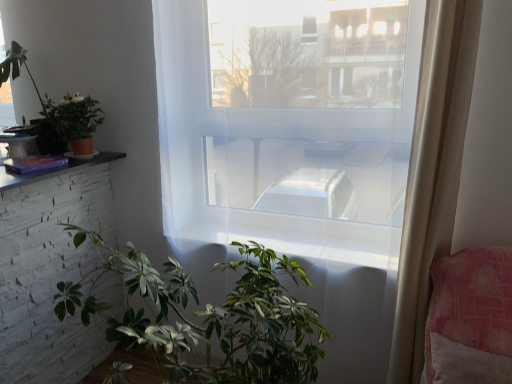
Where is `transparent glass window at center`? transparent glass window at center is located at coordinates (288, 122).

What is the approximate width of matte white table at left?

The width of matte white table at left is 31.16 inches.

Describe the element at coordinates (221, 317) in the screenshot. I see `green matte plant at lower center, acting as the first houseplant starting from the bottom` at that location.

Where is `green matte plant at upper left, which is the first houseplant from left to right`? This screenshot has height=384, width=512. green matte plant at upper left, which is the first houseplant from left to right is located at coordinates (59, 110).

Locate an element on the screen. green matte plant at upper left, placed as the second houseplant when sorted from bottom to top is located at coordinates (69, 124).

The image size is (512, 384). I want to click on transparent glass window at center, so click(288, 122).

Is point (65, 329) behind point (60, 116)?

Yes, it is behind point (60, 116).

From the picture: Can you confirm if matte white table at left is positioned to the left of green matte plant at upper left, which ranks as the 3th houseplant in bottom-to-top order?

Correct, you'll find matte white table at left to the left of green matte plant at upper left, which ranks as the 3th houseplant in bottom-to-top order.

Is matte white table at left directly adjacent to green matte plant at upper left, which is the first houseplant from left to right?

No, matte white table at left is not with green matte plant at upper left, which is the first houseplant from left to right.

Can you tell me how much matte white table at left and green matte plant at upper left, which ranks as the 3th houseplant in bottom-to-top order, differ in facing direction?

They differ by 90 degrees in their facing directions.

Considering the relative sizes of transparent glass window at center and matte white table at left in the image provided, is transparent glass window at center smaller than matte white table at left?

Indeed, transparent glass window at center has a smaller size compared to matte white table at left.

Between transparent glass window at center and matte white table at left, which one appears on the left side from the viewer's perspective?

Positioned to the left is matte white table at left.

Is transparent glass window at center not near matte white table at left?

transparent glass window at center is near matte white table at left, not far away.

Do you think transparent glass window at center is within matte white table at left, or outside of it?

transparent glass window at center is outside matte white table at left.

Can you confirm if transparent glass window at center is positioned to the left of green matte plant at upper left, placed as the 2th houseplant when sorted from right to left?

In fact, transparent glass window at center is to the right of green matte plant at upper left, placed as the 2th houseplant when sorted from right to left.

Considering their positions, is transparent glass window at center located in front of or behind green matte plant at upper left, placed as the 2th houseplant when sorted from right to left?

Visually, transparent glass window at center is located in front of green matte plant at upper left, placed as the 2th houseplant when sorted from right to left.

Considering the relative sizes of transparent glass window at center and green matte plant at upper left, positioned as the second houseplant in top-to-bottom order, in the image provided, is transparent glass window at center smaller than green matte plant at upper left, positioned as the second houseplant in top-to-bottom order,?

Incorrect, transparent glass window at center is not smaller in size than green matte plant at upper left, positioned as the second houseplant in top-to-bottom order.

Would you say transparent glass window at center is outside green matte plant at upper left, placed as the 2th houseplant when sorted from right to left?

Absolutely, transparent glass window at center is external to green matte plant at upper left, placed as the 2th houseplant when sorted from right to left.

Would you say matte white table at left is outside green matte plant at upper left, which is the second houseplant from left to right?

Indeed, matte white table at left is completely outside green matte plant at upper left, which is the second houseplant from left to right.

Between matte white table at left and green matte plant at upper left, placed as the second houseplant when sorted from bottom to top, which one is positioned in front?

matte white table at left is closer to the camera.

The height and width of the screenshot is (384, 512). In the image, there is a green matte plant at upper left, positioned as the second houseplant in top-to-bottom order. Find the location of `table below it (from a real-world perspective)`. table below it (from a real-world perspective) is located at coordinates (50, 269).

From the image's perspective, is matte white table at left positioned above or below green matte plant at upper left, placed as the second houseplant when sorted from bottom to top?

From the image's perspective, matte white table at left appears below green matte plant at upper left, placed as the second houseplant when sorted from bottom to top.

Does matte white table at left touch green matte plant at lower center, acting as the third houseplant starting from the top?

No, matte white table at left is not touching green matte plant at lower center, acting as the third houseplant starting from the top.

Between matte white table at left and green matte plant at lower center, which ranks as the first houseplant in right-to-left order, which one appears on the right side from the viewer's perspective?

From the viewer's perspective, green matte plant at lower center, which ranks as the first houseplant in right-to-left order, appears more on the right side.

Is matte white table at left positioned beyond the bounds of green matte plant at lower center, acting as the third houseplant starting from the top?

matte white table at left lies outside green matte plant at lower center, acting as the third houseplant starting from the top,'s area.

From a real-world perspective, is matte white table at left positioned above or below green matte plant at lower center, which ranks as the first houseplant in right-to-left order?

From a real-world perspective, matte white table at left is physically above green matte plant at lower center, which ranks as the first houseplant in right-to-left order.

Would you say green matte plant at lower center, acting as the first houseplant starting from the bottom, is outside green matte plant at upper left, placed as the second houseplant when sorted from bottom to top?

Indeed, green matte plant at lower center, acting as the first houseplant starting from the bottom, is completely outside green matte plant at upper left, placed as the second houseplant when sorted from bottom to top.

Which is closer to the camera, (215, 381) or (49, 124)?

The point (215, 381) is closer.

Looking at this image, from a real-world perspective, is green matte plant at lower center, acting as the third houseplant starting from the top, on top of green matte plant at upper left, placed as the second houseplant when sorted from bottom to top?

Incorrect, from a real-world perspective, green matte plant at lower center, acting as the third houseplant starting from the top, is lower than green matte plant at upper left, placed as the second houseplant when sorted from bottom to top.

Is green matte plant at lower center, acting as the first houseplant starting from the bottom, at the left side of green matte plant at upper left, placed as the second houseplant when sorted from bottom to top?

No.

Is green matte plant at upper left, placed as the second houseplant when sorted from bottom to top, facing away from green matte plant at upper left, which ranks as the 3th houseplant in bottom-to-top order?

No.

From the image's perspective, would you say green matte plant at upper left, which is the second houseplant from left to right, is shown under green matte plant at upper left, which is the 1th houseplant in top-to-bottom order?

Correct, green matte plant at upper left, which is the second houseplant from left to right, appears lower than green matte plant at upper left, which is the 1th houseplant in top-to-bottom order, in the image.

Looking at this image, can you confirm if green matte plant at upper left, placed as the 2th houseplant when sorted from right to left, is wider than green matte plant at upper left, the 3th houseplant in the right-to-left sequence?

In fact, green matte plant at upper left, placed as the 2th houseplant when sorted from right to left, might be narrower than green matte plant at upper left, the 3th houseplant in the right-to-left sequence.

Is green matte plant at upper left, placed as the 2th houseplant when sorted from right to left, shorter than green matte plant at upper left, which ranks as the 3th houseplant in bottom-to-top order?

Yes.

Find the location of a particular element. the 1st houseplant counting from the right side of the matte white table at left is located at coordinates (59, 110).

Locate an element on the screen. Image resolution: width=512 pixels, height=384 pixels. table on the left of transparent glass window at center is located at coordinates (50, 269).

Considering their positions, is green matte plant at upper left, the 3th houseplant in the right-to-left sequence, positioned further to green matte plant at lower center, acting as the third houseplant starting from the top, than matte white table at left?

green matte plant at upper left, the 3th houseplant in the right-to-left sequence, is further to green matte plant at lower center, acting as the third houseplant starting from the top.

Estimate the real-world distances between objects in this image. Which object is further from green matte plant at upper left, which is the first houseplant from left to right, green matte plant at upper left, which is the second houseplant from left to right, or green matte plant at lower center, acting as the first houseplant starting from the bottom?

The object further to green matte plant at upper left, which is the first houseplant from left to right, is green matte plant at lower center, acting as the first houseplant starting from the bottom.

Which object lies further to the anchor point green matte plant at upper left, which is the second houseplant from left to right, green matte plant at upper left, which is the 1th houseplant in top-to-bottom order, or green matte plant at lower center, acting as the first houseplant starting from the bottom?

green matte plant at lower center, acting as the first houseplant starting from the bottom.

Based on their spatial positions, is green matte plant at upper left, positioned as the second houseplant in top-to-bottom order, or green matte plant at lower center, which ranks as the first houseplant in right-to-left order, further from transparent glass window at center?

green matte plant at upper left, positioned as the second houseplant in top-to-bottom order, lies further to transparent glass window at center than the other object.

Estimate the real-world distances between objects in this image. Which object is further from green matte plant at upper left, which is the second houseplant from left to right, green matte plant at upper left, which is the 1th houseplant in top-to-bottom order, or transparent glass window at center?

Among the two, transparent glass window at center is located further to green matte plant at upper left, which is the second houseplant from left to right.

When comparing their distances from matte white table at left, does green matte plant at upper left, placed as the second houseplant when sorted from bottom to top, or green matte plant at lower center, acting as the first houseplant starting from the bottom, seem further?

Among the two, green matte plant at lower center, acting as the first houseplant starting from the bottom, is located further to matte white table at left.

When comparing their distances from green matte plant at upper left, which is the second houseplant from left to right, does transparent glass window at center or green matte plant at upper left, which ranks as the 3th houseplant in bottom-to-top order, seem further?

transparent glass window at center is positioned further to the anchor green matte plant at upper left, which is the second houseplant from left to right.

When comparing their distances from green matte plant at upper left, which is the second houseplant from left to right, does green matte plant at lower center, acting as the third houseplant starting from the top, or transparent glass window at center seem further?

The object further to green matte plant at upper left, which is the second houseplant from left to right, is green matte plant at lower center, acting as the third houseplant starting from the top.

Locate an element on the screen. The width and height of the screenshot is (512, 384). houseplant between green matte plant at lower center, which ranks as the first houseplant in right-to-left order, and green matte plant at upper left, which is the first houseplant from left to right, from front to back is located at coordinates (69, 124).

Where is `table between green matte plant at upper left, which is the 1th houseplant in top-to-bottom order, and green matte plant at lower center, acting as the third houseplant starting from the top, in the up-down direction`? This screenshot has width=512, height=384. table between green matte plant at upper left, which is the 1th houseplant in top-to-bottom order, and green matte plant at lower center, acting as the third houseplant starting from the top, in the up-down direction is located at coordinates (50, 269).

I want to click on houseplant between green matte plant at upper left, the 3th houseplant in the right-to-left sequence, and matte white table at left from top to bottom, so click(69, 124).

Find the location of `window between green matte plant at lower center, acting as the first houseplant starting from the bottom, and green matte plant at upper left, placed as the second houseplant when sorted from bottom to top, from front to back`. window between green matte plant at lower center, acting as the first houseplant starting from the bottom, and green matte plant at upper left, placed as the second houseplant when sorted from bottom to top, from front to back is located at coordinates (288, 122).